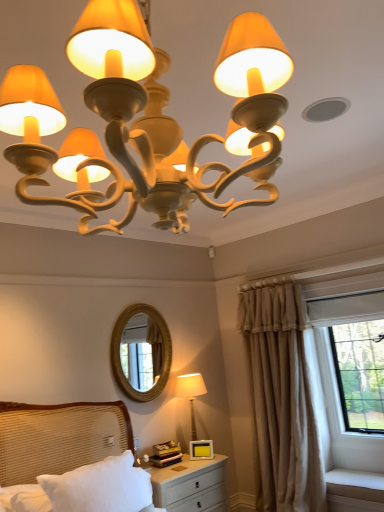
Question: From the image's perspective, is matte cream lamp at lower center, which appears as the 1th lamp when ordered from the bottom, below matte cream chandelier at upper center, which is counted as the 1th lamp, starting from the top?

Choices:
 (A) no
 (B) yes

Answer: (B)

Question: Are matte cream lamp at lower center, which appears as the 1th lamp when ordered from the bottom, and matte cream chandelier at upper center, the first lamp positioned from the front, located far from each other?

Choices:
 (A) no
 (B) yes

Answer: (B)

Question: Can you confirm if matte cream lamp at lower center, the 2th lamp positioned from the front, is thinner than matte cream chandelier at upper center, the first lamp positioned from the front?

Choices:
 (A) no
 (B) yes

Answer: (B)

Question: Does matte cream lamp at lower center, placed as the 1th lamp when sorted from back to front, turn towards matte cream chandelier at upper center, which is counted as the 1th lamp, starting from the top?

Choices:
 (A) no
 (B) yes

Answer: (A)

Question: Is matte cream lamp at lower center, placed as the 2th lamp when sorted from top to bottom, closer to the viewer compared to matte cream chandelier at upper center, which is counted as the 1th lamp, starting from the top?

Choices:
 (A) yes
 (B) no

Answer: (B)

Question: From a real-world perspective, is matte cream lamp at lower center, placed as the 2th lamp when sorted from top to bottom, located higher than matte cream chandelier at upper center, which is counted as the 1th lamp, starting from the top?

Choices:
 (A) no
 (B) yes

Answer: (A)

Question: Does matte cream lamp at lower center, placed as the 1th lamp when sorted from back to front, have a lesser height compared to white matte nightstand at lower center?

Choices:
 (A) no
 (B) yes

Answer: (A)

Question: Is matte cream lamp at lower center, placed as the 2th lamp when sorted from top to bottom, smaller than white matte nightstand at lower center?

Choices:
 (A) yes
 (B) no

Answer: (A)

Question: Is matte cream lamp at lower center, which appears as the 1th lamp when ordered from the bottom, aimed at white matte nightstand at lower center?

Choices:
 (A) no
 (B) yes

Answer: (A)

Question: Is matte cream lamp at lower center, placed as the 1th lamp when sorted from back to front, further to camera compared to white matte nightstand at lower center?

Choices:
 (A) no
 (B) yes

Answer: (B)

Question: Would you say matte cream lamp at lower center, placed as the 1th lamp when sorted from back to front, is outside white matte nightstand at lower center?

Choices:
 (A) no
 (B) yes

Answer: (B)

Question: Does matte cream lamp at lower center, the 2th lamp positioned from the front, come in front of white matte nightstand at lower center?

Choices:
 (A) yes
 (B) no

Answer: (B)

Question: Is white textured bed at lower left shorter than gold textured mirror at center?

Choices:
 (A) yes
 (B) no

Answer: (A)